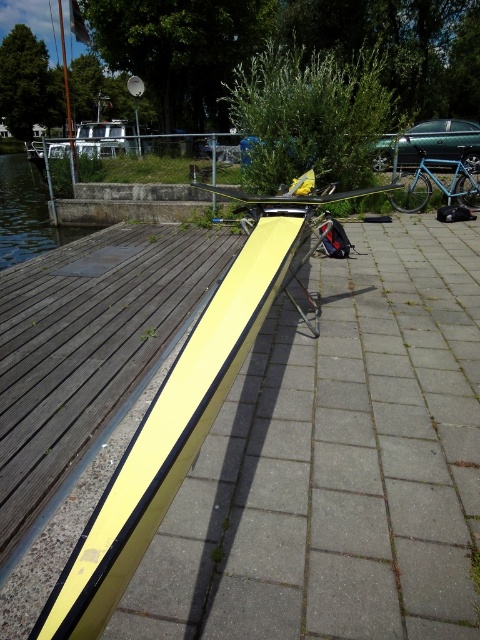
Is transparent water at dock left positioned before blue metallic bicycle at right?

Yes, it is in front of blue metallic bicycle at right.

Which is more to the left, transparent water at dock left or blue metallic bicycle at right?

transparent water at dock left

Measure the distance between point (39,241) and camera.

Point (39,241) and camera are 11.39 meters apart.

At what (x,y) coordinates should I click in order to perform the action: click on transparent water at dock left. Please return your answer as a coordinate pair (x, y). This screenshot has height=640, width=480. Looking at the image, I should click on (26, 212).